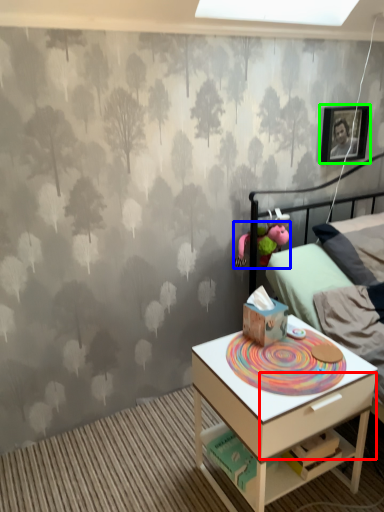
Question: Which object is the farthest from drawer (highlighted by a red box)? Choose among these: toy (highlighted by a blue box) or picture frame (highlighted by a green box).

Choices:
 (A) toy
 (B) picture frame

Answer: (B)